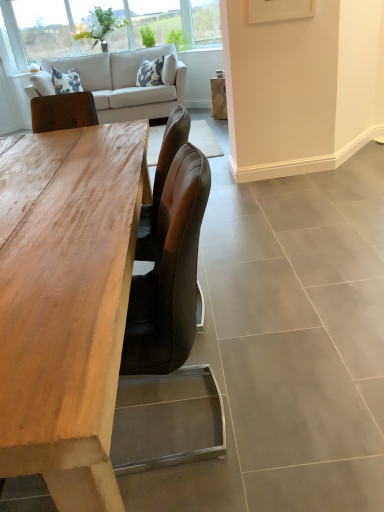
Question: Is light beige fabric couch at upper left positioned with its back to clear glass window at upper left?

Choices:
 (A) yes
 (B) no

Answer: (B)

Question: Is light beige fabric couch at upper left taller than clear glass window at upper left?

Choices:
 (A) yes
 (B) no

Answer: (A)

Question: From a real-world perspective, is light beige fabric couch at upper left under clear glass window at upper left?

Choices:
 (A) yes
 (B) no

Answer: (A)

Question: Is light beige fabric couch at upper left to the right of clear glass window at upper left from the viewer's perspective?

Choices:
 (A) yes
 (B) no

Answer: (A)

Question: Can you confirm if light beige fabric couch at upper left is smaller than clear glass window at upper left?

Choices:
 (A) yes
 (B) no

Answer: (B)

Question: Is light beige fabric couch at upper left completely or partially outside of clear glass window at upper left?

Choices:
 (A) no
 (B) yes

Answer: (B)

Question: Does wooden table at center have a greater width compared to light beige fabric couch at upper left?

Choices:
 (A) no
 (B) yes

Answer: (B)

Question: Is light beige fabric couch at upper left surrounded by wooden table at center?

Choices:
 (A) yes
 (B) no

Answer: (B)

Question: Is the surface of wooden table at center in direct contact with light beige fabric couch at upper left?

Choices:
 (A) yes
 (B) no

Answer: (B)

Question: From the image's perspective, is wooden table at center located beneath light beige fabric couch at upper left?

Choices:
 (A) yes
 (B) no

Answer: (A)

Question: Can you confirm if wooden table at center is positioned to the left of light beige fabric couch at upper left?

Choices:
 (A) yes
 (B) no

Answer: (B)

Question: Is wooden table at center not near light beige fabric couch at upper left?

Choices:
 (A) no
 (B) yes

Answer: (B)

Question: From a real-world perspective, does light beige fabric couch at upper left sit lower than wooden table at center?

Choices:
 (A) no
 (B) yes

Answer: (A)